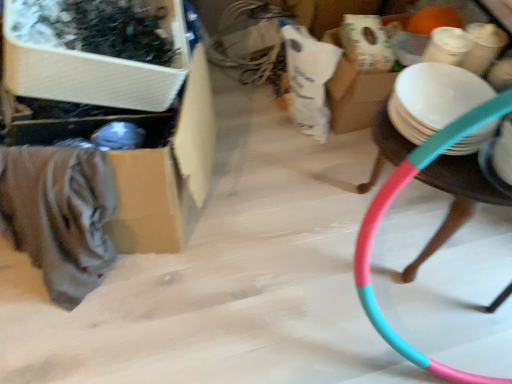
Identify the location of free region under pink plastic hoop at right (from a real-world perspective). This screenshot has height=384, width=512. (424, 227).